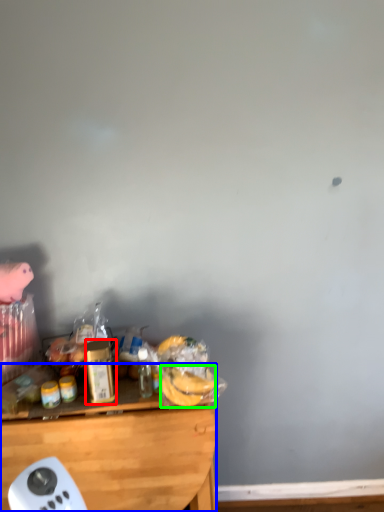
Question: Which is farther away from bottle (highlighted by a red box)? desk (highlighted by a blue box) or food (highlighted by a green box)?

Choices:
 (A) desk
 (B) food

Answer: (B)